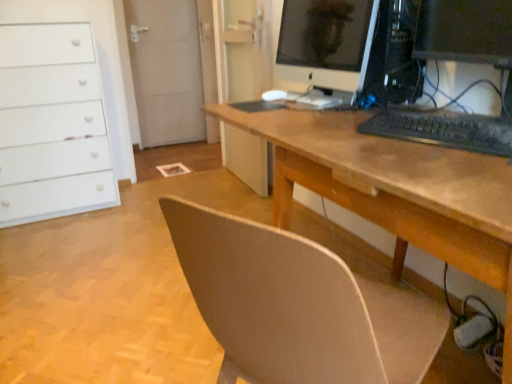
Identify the location of vacant space that is to the left of black matte keyboard at center. The height and width of the screenshot is (384, 512). (345, 136).